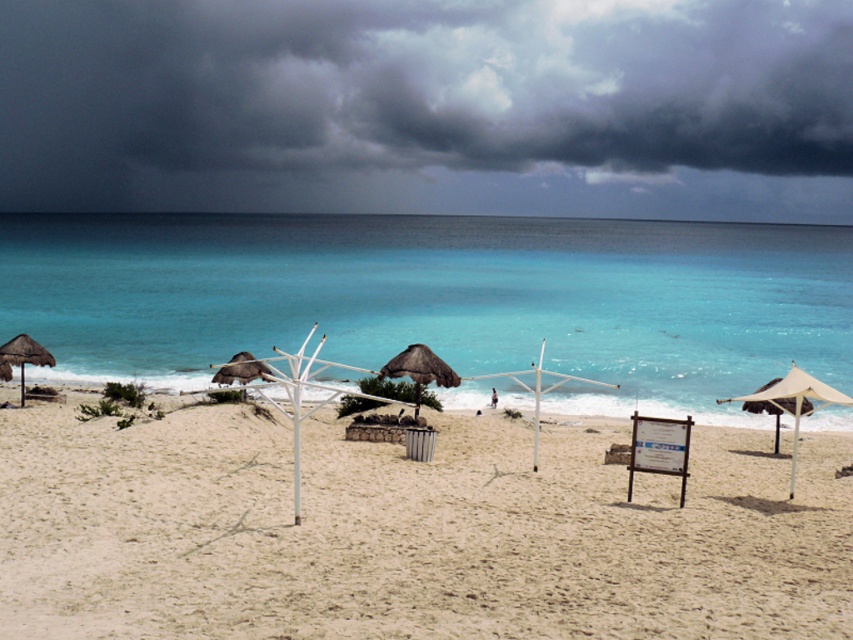
Which of these two, light beige sand at center or white canvas umbrella at right, stands shorter?

With less height is light beige sand at center.

Which is behind, point (846, 522) or point (779, 403)?

Positioned behind is point (779, 403).

This screenshot has height=640, width=853. Find the location of `light beige sand at center`. light beige sand at center is located at coordinates (410, 531).

Who is more forward, (695, 275) or (253, 372)?

Point (253, 372) is in front.

Which is behind, point (30, 324) or point (244, 355)?

Positioned behind is point (30, 324).

Identify the location of blue clear water at center. (440, 300).

Between point (22, 353) and point (1, 372), which one is positioned in front?

Point (1, 372) is more forward.

Does point (30, 340) lie in front of point (7, 371)?

No, (30, 340) is behind (7, 371).

Who is more forward, (26, 337) or (0, 371)?

Point (0, 371)

Locate an element on the screen. thatched straw umbrella at left is located at coordinates (24, 355).